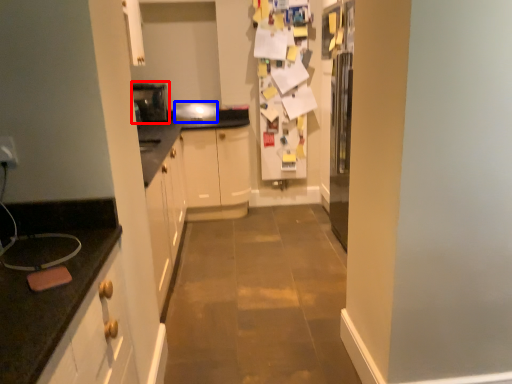
Question: Among these objects, which one is farthest to the camera, appliance (highlighted by a red box) or appliance (highlighted by a blue box)?

Choices:
 (A) appliance
 (B) appliance

Answer: (B)